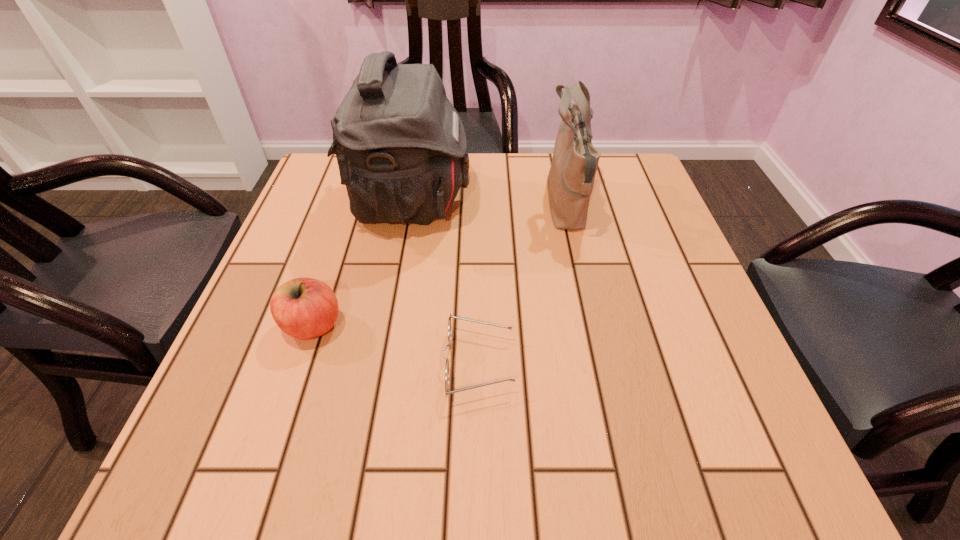
Identify which object is the nearest to the taller shoulder bag. Please provide its 2D coordinates. Your answer should be formatted as a tuple, i.e. [(x, y)], where the tuple contains the x and y coordinates of a point satisfying the conditions above.

[(304, 308)]

Select which object appears as the closest to the third tallest object. Please provide its 2D coordinates. Your answer should be formatted as a tuple, i.e. [(x, y)], where the tuple contains the x and y coordinates of a point satisfying the conditions above.

[(401, 148)]

This screenshot has height=540, width=960. I want to click on vacant point that satisfies the following two spatial constraints: 1. on the open flap of the left shoulder bag; 2. on the front side of the third tallest object, so click(389, 326).

Identify the location of vacant point that satisfies the following two spatial constraints: 1. on the open flap of the tallest object; 2. on the front side of the third tallest object. The image size is (960, 540). (389, 326).

The height and width of the screenshot is (540, 960). What are the coordinates of `vacant space that satisfies the following two spatial constraints: 1. on the front-facing side of the right shoulder bag; 2. on the front side of the second shortest object` in the screenshot? It's located at (593, 326).